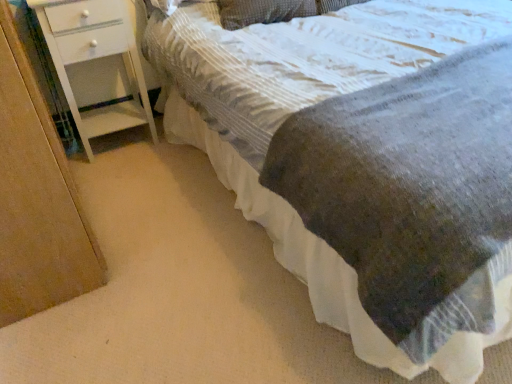
Question: From a real-world perspective, is textured gray blanket at center above or below white painted wood chest of drawers at left?

Choices:
 (A) above
 (B) below

Answer: (A)

Question: Considering the positions of textured gray blanket at center and white painted wood chest of drawers at left in the image, is textured gray blanket at center wider or thinner than white painted wood chest of drawers at left?

Choices:
 (A) thin
 (B) wide

Answer: (B)

Question: Considering the real-world distances, which object is farthest from the textured gray blanket at center?

Choices:
 (A) textured gray pillow at upper center
 (B) white painted wood chest of drawers at left

Answer: (B)

Question: Which is farther from the textured gray pillow at upper center?

Choices:
 (A) textured gray blanket at center
 (B) white painted wood chest of drawers at left

Answer: (B)